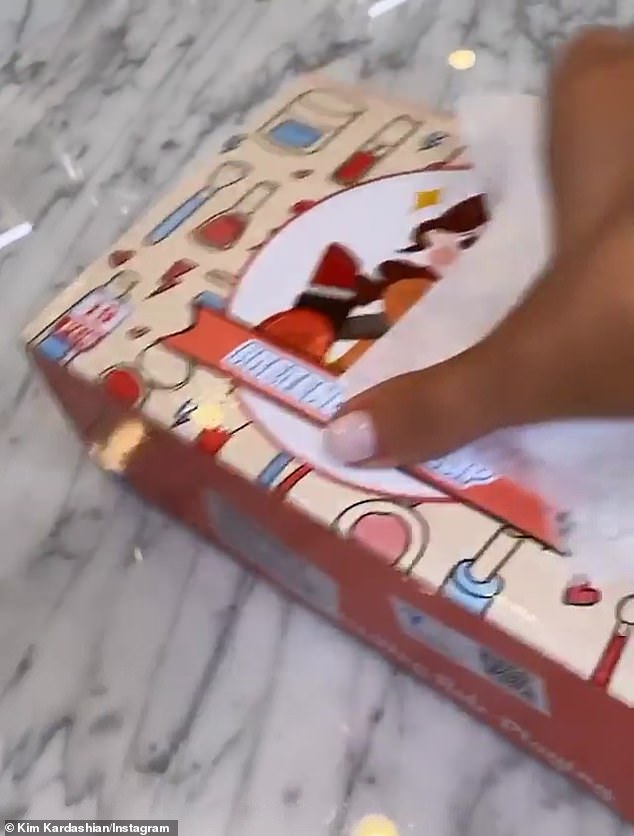
This screenshot has height=836, width=634. In order to click on box in this screenshot , I will do `click(579, 709)`.